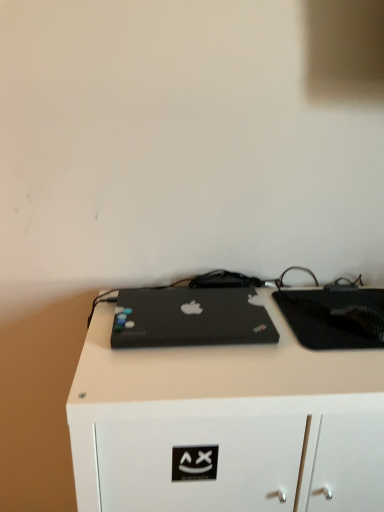
At what (x,y) coordinates should I click in order to perform the action: click on black matte laptop at center. Please return your answer as a coordinate pair (x, y). Looking at the image, I should click on [190, 318].

Image resolution: width=384 pixels, height=512 pixels. What do you see at coordinates (226, 425) in the screenshot? I see `black matte desk at center` at bounding box center [226, 425].

At what (x,y) coordinates should I click in order to perform the action: click on black matte tablet at center. Please return your answer as a coordinate pair (x, y). Looking at the image, I should click on (329, 317).

Does black matte desk at center have a smaller size compared to black matte tablet at center?

Actually, black matte desk at center might be larger than black matte tablet at center.

Does point (306, 462) come closer to viewer compared to point (319, 331)?

That is True.

In the scene shown: Is black matte desk at center beside black matte tablet at center?

No.

Can you confirm if black matte desk at center is thinner than black matte tablet at center?

No.

Which object is more forward, black matte tablet at center or black matte laptop at center?

black matte laptop at center is in front.

Considering the relative sizes of black matte tablet at center and black matte laptop at center in the image provided, is black matte tablet at center taller than black matte laptop at center?

No.

Does black matte tablet at center have a lesser width compared to black matte laptop at center?

Incorrect, the width of black matte tablet at center is not less than that of black matte laptop at center.

Is black matte laptop at center oriented away from black matte desk at center?

black matte laptop at center is not turned away from black matte desk at center.

Considering the points (134, 298) and (307, 367), which point is in front, point (134, 298) or point (307, 367)?

The point (307, 367) is in front.

In the scene shown: Is black matte laptop at center bigger or smaller than black matte desk at center?

black matte laptop at center is smaller than black matte desk at center.

Can you confirm if black matte desk at center is taller than black matte laptop at center?

Correct, black matte desk at center is much taller as black matte laptop at center.

Is black matte laptop at center a part of black matte desk at center?

No.

From the image's perspective, between black matte desk at center and black matte laptop at center, who is located below?

black matte desk at center is shown below in the image.

What's the angular difference between black matte desk at center and black matte laptop at center's facing directions?

The angular difference between black matte desk at center and black matte laptop at center is 9.12e-05 degrees.

In order to click on laptop on the left of the black matte tablet at center in this screenshot , I will do `click(190, 318)`.

Which of these two, black matte laptop at center or black matte tablet at center, is bigger?

black matte laptop at center is bigger.

Is black matte laptop at center at the right side of black matte tablet at center?

No, black matte laptop at center is not to the right of black matte tablet at center.

Which of these two, black matte laptop at center or black matte tablet at center, is thinner?

black matte laptop at center is thinner.

Is black matte tablet at center completely or partially outside of black matte desk at center?

Indeed, black matte tablet at center is completely outside black matte desk at center.

Which is behind, black matte tablet at center or black matte desk at center?

black matte tablet at center is more distant.

Where is `desk on the left side of black matte tablet at center`? This screenshot has height=512, width=384. desk on the left side of black matte tablet at center is located at coordinates (226, 425).

Identify the location of laptop in front of the black matte tablet at center. The width and height of the screenshot is (384, 512). (190, 318).

Considering their positions, is black matte laptop at center positioned further to black matte tablet at center than black matte desk at center?

Based on the image, black matte desk at center appears to be further to black matte tablet at center.

Looking at this image, which object lies further to the anchor point black matte laptop at center, black matte desk at center or black matte tablet at center?

black matte tablet at center is further to black matte laptop at center.

Based on their spatial positions, is black matte tablet at center or black matte desk at center further from black matte laptop at center?

black matte tablet at center is further to black matte laptop at center.

Considering their positions, is black matte tablet at center positioned further to black matte desk at center than black matte laptop at center?

black matte tablet at center is further to black matte desk at center.

Estimate the real-world distances between objects in this image. Which object is closer to black matte tablet at center, black matte desk at center or black matte laptop at center?

The object closer to black matte tablet at center is black matte laptop at center.

Estimate the real-world distances between objects in this image. Which object is further from black matte desk at center, black matte laptop at center or black matte tablet at center?

Among the two, black matte tablet at center is located further to black matte desk at center.

The image size is (384, 512). I want to click on tablet computer between black matte laptop at center and black matte desk at center in the vertical direction, so click(329, 317).